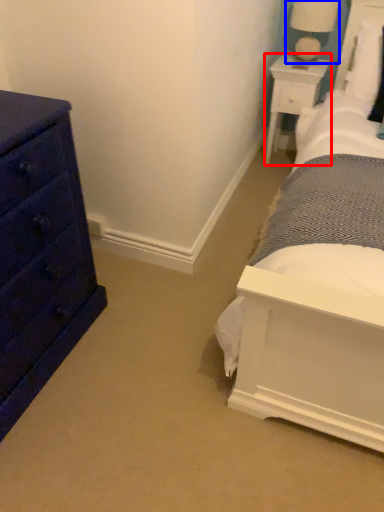
Question: Which object is further to the camera taking this photo, nightstand (highlighted by a red box) or table lamp (highlighted by a blue box)?

Choices:
 (A) nightstand
 (B) table lamp

Answer: (A)